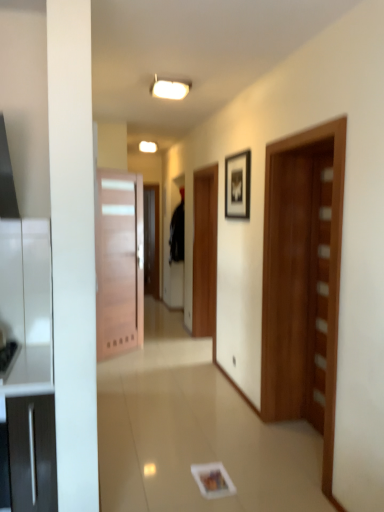
Question: Considering their positions, is black fabric robe at center located in front of or behind wooden door at left, which appears as the 2th door when viewed from the right?

Choices:
 (A) front
 (B) behind

Answer: (B)

Question: Is black fabric robe at center taller or shorter than wooden door at left, marked as the 1th door in a back-to-front arrangement?

Choices:
 (A) short
 (B) tall

Answer: (A)

Question: Which object is positioned farthest from the wooden door at right, acting as the 2th door starting from the left?

Choices:
 (A) wooden door at left, the 2th door from the front
 (B) black fabric robe at center
 (C) white glossy ceiling light at upper center
 (D) black matte picture frame at upper center

Answer: (B)

Question: Based on their relative distances, which object is nearer to the wooden door at right, which is counted as the 2th door, starting from the back?

Choices:
 (A) white glossy ceiling light at upper center
 (B) black matte picture frame at upper center
 (C) wooden door at left, which appears as the 2th door when viewed from the right
 (D) black fabric robe at center

Answer: (B)